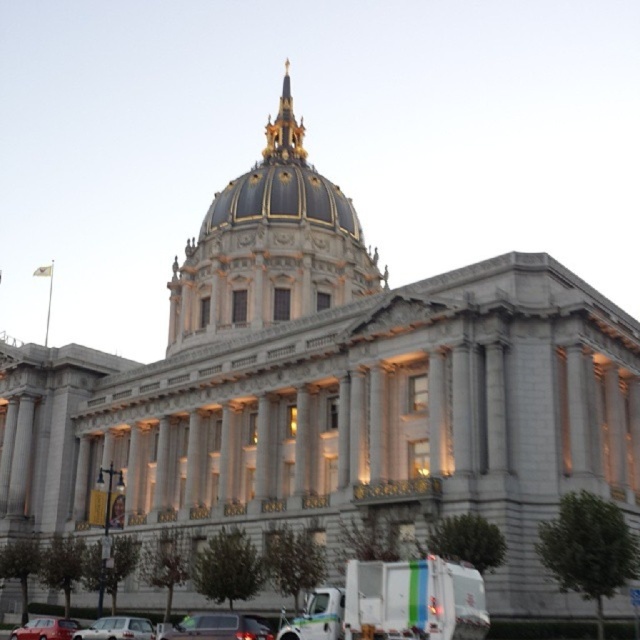
Question: Does goldmaterial/texturedome at center have a larger size compared to white glossy truck at lower center?

Choices:
 (A) no
 (B) yes

Answer: (B)

Question: Which is nearer to the shiny red car at lower left?

Choices:
 (A) goldmaterial/texturedome at center
 (B) silver metallic sedan at lower center
 (C) shiny silver sedan at lower center
 (D) white glossy truck at lower center

Answer: (B)

Question: Which of these objects is positioned closest to the shiny red car at lower left?

Choices:
 (A) shiny silver sedan at lower center
 (B) goldmaterial/texturedome at center
 (C) silver metallic sedan at lower center
 (D) white glossy truck at lower center

Answer: (C)

Question: Where is white glossy truck at lower center located in relation to shiny red car at lower left in the image?

Choices:
 (A) above
 (B) below

Answer: (A)

Question: Which of the following is the farthest from the observer?

Choices:
 (A) white glossy truck at lower center
 (B) goldmaterial/texturedome at center
 (C) shiny silver sedan at lower center
 (D) shiny red car at lower left

Answer: (B)

Question: Considering the relative positions of shiny silver sedan at lower center and shiny red car at lower left in the image provided, where is shiny silver sedan at lower center located with respect to shiny red car at lower left?

Choices:
 (A) right
 (B) left

Answer: (A)